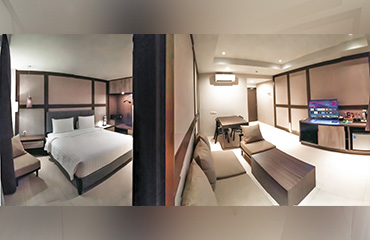
At what (x,y) coordinates should I click in order to perform the action: click on wooden table. Please return your answer as a coordinate pair (x, y). This screenshot has width=370, height=240. Looking at the image, I should click on (270, 166), (227, 121).